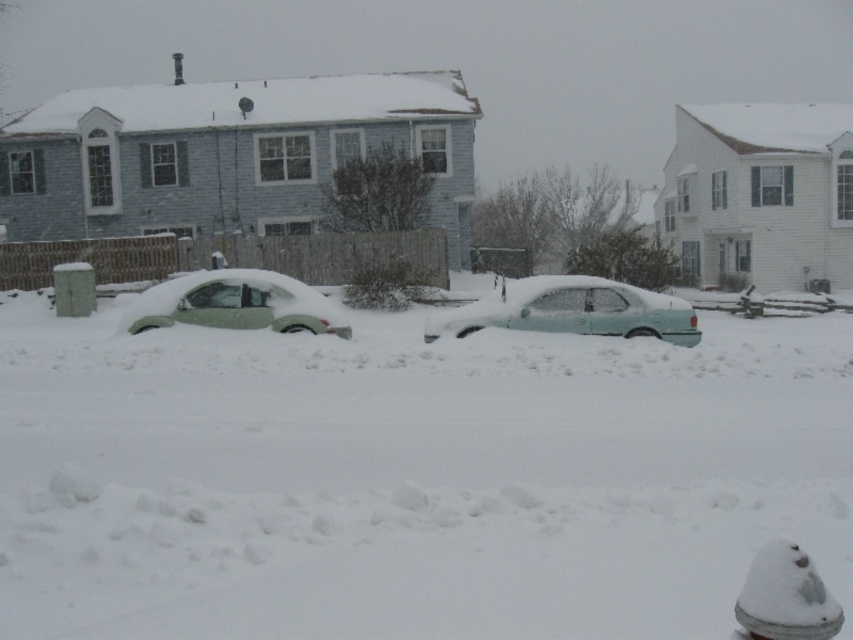
Question: Which point appears farthest from the camera in this image?

Choices:
 (A) (793, 556)
 (B) (151, 412)

Answer: (B)

Question: Which point is farther from the camera taking this photo?

Choices:
 (A) (306, 310)
 (B) (787, 616)

Answer: (A)

Question: Is white fluffy snow at center wider than white plastic hydrant at lower right?

Choices:
 (A) no
 (B) yes

Answer: (B)

Question: Does light blue matte car at center have a greater width compared to white plastic hydrant at lower right?

Choices:
 (A) no
 (B) yes

Answer: (B)

Question: Which of the following is the closest to the observer?

Choices:
 (A) pyautogui.click(x=192, y=276)
 (B) pyautogui.click(x=514, y=314)
 (C) pyautogui.click(x=596, y=518)
 (D) pyautogui.click(x=819, y=625)

Answer: (D)

Question: Is light blue matte car at center wider than green matte car at left?

Choices:
 (A) yes
 (B) no

Answer: (B)